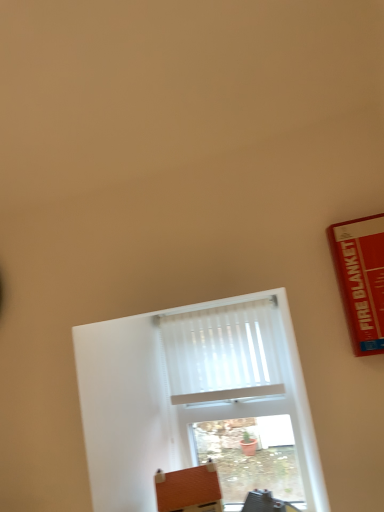
Question: Is white matte window at center bigger than brown leather cushion at lower center?

Choices:
 (A) yes
 (B) no

Answer: (A)

Question: Is white matte window at center oriented towards brown leather cushion at lower center?

Choices:
 (A) no
 (B) yes

Answer: (B)

Question: Is white matte window at center outside brown leather cushion at lower center?

Choices:
 (A) yes
 (B) no

Answer: (A)

Question: Can you confirm if white matte window at center is thinner than brown leather cushion at lower center?

Choices:
 (A) yes
 (B) no

Answer: (A)

Question: Can you confirm if white matte window at center is positioned to the right of brown leather cushion at lower center?

Choices:
 (A) no
 (B) yes

Answer: (B)

Question: From a real-world perspective, is white pleated curtain at center positioned above or below white matte window at center?

Choices:
 (A) above
 (B) below

Answer: (A)

Question: From the image's perspective, is white pleated curtain at center positioned above or below white matte window at center?

Choices:
 (A) above
 (B) below

Answer: (A)

Question: In the image, is white pleated curtain at center positioned in front of or behind white matte window at center?

Choices:
 (A) behind
 (B) front

Answer: (A)

Question: Considering the positions of white pleated curtain at center and white matte window at center in the image, is white pleated curtain at center bigger or smaller than white matte window at center?

Choices:
 (A) small
 (B) big

Answer: (A)

Question: Based on their positions, is white pleated curtain at center located to the left or right of brown leather cushion at lower center?

Choices:
 (A) right
 (B) left

Answer: (A)

Question: Is white pleated curtain at center taller or shorter than brown leather cushion at lower center?

Choices:
 (A) short
 (B) tall

Answer: (B)

Question: In terms of size, does white pleated curtain at center appear bigger or smaller than brown leather cushion at lower center?

Choices:
 (A) big
 (B) small

Answer: (B)

Question: From the image's perspective, is white pleated curtain at center located above or below brown leather cushion at lower center?

Choices:
 (A) above
 (B) below

Answer: (A)

Question: Considering the positions of white matte window at center and white pleated curtain at center in the image, is white matte window at center wider or thinner than white pleated curtain at center?

Choices:
 (A) wide
 (B) thin

Answer: (A)

Question: From their relative heights in the image, would you say white matte window at center is taller or shorter than white pleated curtain at center?

Choices:
 (A) short
 (B) tall

Answer: (B)